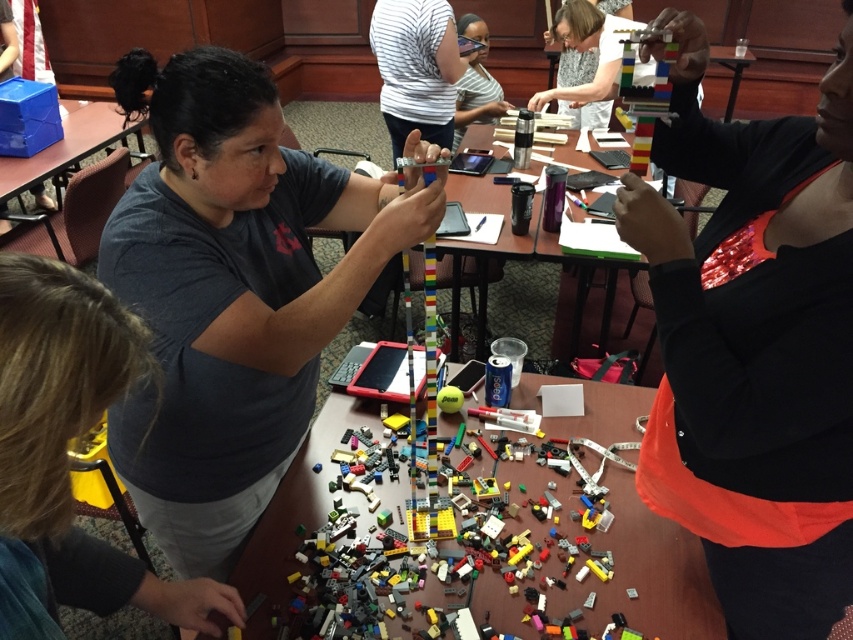
You are a participant in the LEGO workshop and want to place the shiny metallic bracelet at upper right on top of the blue plastic table at upper left. Is the bracelet tall enough to block the view of the table?

The shiny metallic bracelet at upper right has a greater height compared to blue plastic table at upper left, so placing it on top would block the view of the table since it is taller.

You are standing at the point labeled as point (7, 160) and want to reach the point labeled as point (177, 602). Which direction should you move to get there?

You should move forward because point (177, 602) is in front of point (7, 160).

You are a photographer positioned at the back of the room. You need to take a photo of the matte gray shirt at upper center and the blue plastic table at upper left. Based on their positions, which object is closer to the right side of the photo frame?

The matte gray shirt at upper center is to the right of the blue plastic table at upper left, so in the photo frame, the matte gray shirt at upper center will be closer to the right side.